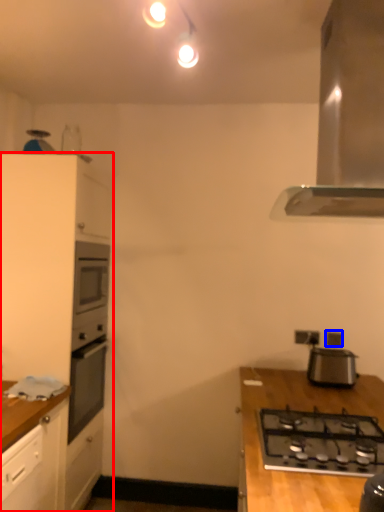
Question: Which object is further to the camera taking this photo, cabinetry (highlighted by a red box) or electric outlet (highlighted by a blue box)?

Choices:
 (A) cabinetry
 (B) electric outlet

Answer: (B)